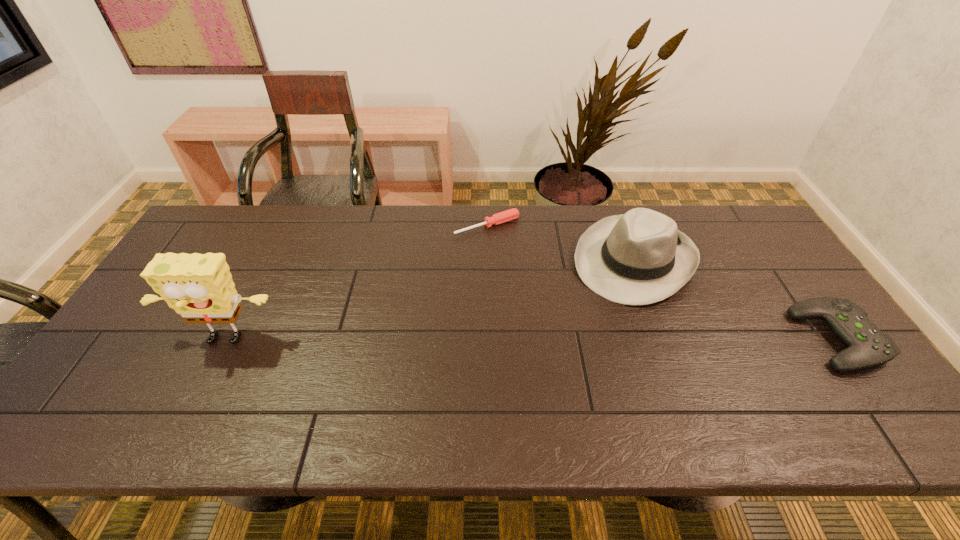
Where is `free space located 0.290m at the blade of the screwdriver`? free space located 0.290m at the blade of the screwdriver is located at coordinates (553, 294).

You are a GUI agent. You are given a task and a screenshot of the screen. Output one action in this format:
    pyautogui.click(x=<x>, y=<y>)
    Task: Click on the free region located at the blade of the screwdriver
    Image resolution: width=960 pixels, height=540 pixels.
    Given the screenshot: What is the action you would take?
    pyautogui.click(x=567, y=311)

Where is `vacant space situated on the front-facing side of the third shortest object`? vacant space situated on the front-facing side of the third shortest object is located at coordinates (586, 323).

Where is `vacant region located on the front-facing side of the third shortest object`? vacant region located on the front-facing side of the third shortest object is located at coordinates (577, 335).

Locate an element on the screen. The width and height of the screenshot is (960, 540). blank area located on the front-facing side of the third shortest object is located at coordinates (548, 371).

You are a GUI agent. You are given a task and a screenshot of the screen. Output one action in this format:
    pyautogui.click(x=<x>, y=<y>)
    Task: Click on the screwdriver that is at the far edge
    This screenshot has height=540, width=960.
    Given the screenshot: What is the action you would take?
    pyautogui.click(x=511, y=214)

Identify the location of fedora that is at the far edge. Image resolution: width=960 pixels, height=540 pixels. (638, 258).

Where is `object that is at the near edge`? The height and width of the screenshot is (540, 960). object that is at the near edge is located at coordinates (868, 346).

In order to click on object that is at the left edge in this screenshot , I will do click(199, 287).

The height and width of the screenshot is (540, 960). Find the location of `object present at the right edge`. object present at the right edge is located at coordinates (868, 346).